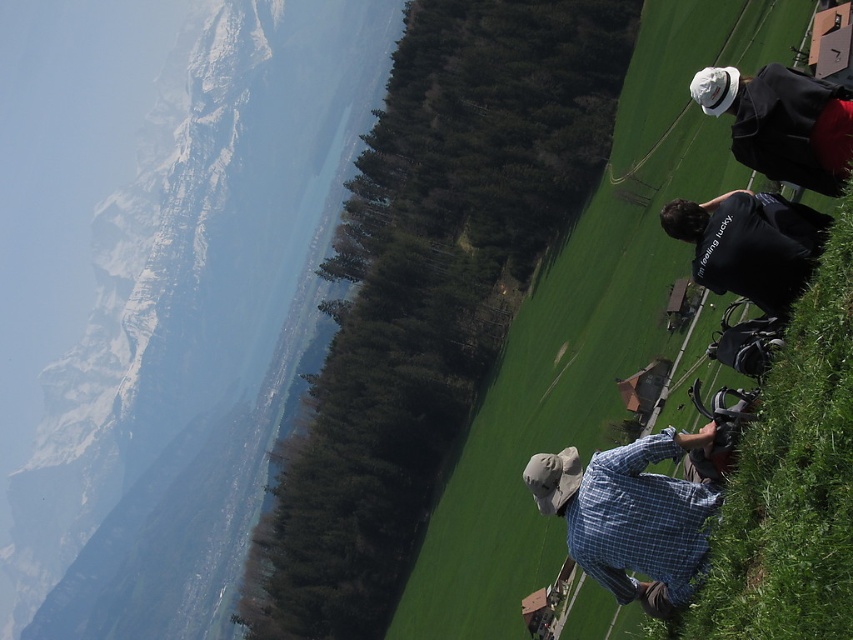
You are a photographer trying to capture both the blue plaid shirt at lower right and the white matte hat at upper right in the same frame. Given their sizes, which object should you focus on to ensure both are visible without zooming in or out?

Since the blue plaid shirt at lower right is larger than the white matte hat at upper right, you should focus on the blue plaid shirt at lower right to ensure both objects are visible in the frame without adjusting the zoom.

You are a photographer trying to capture a photo of the blue plaid shirt at lower right and the white matte hat at upper right in the same frame. Based on their positions, which object is closer to the left edge of the image?

The blue plaid shirt at lower right is positioned to the left of the white matte hat at upper right, so it is closer to the left edge of the image.